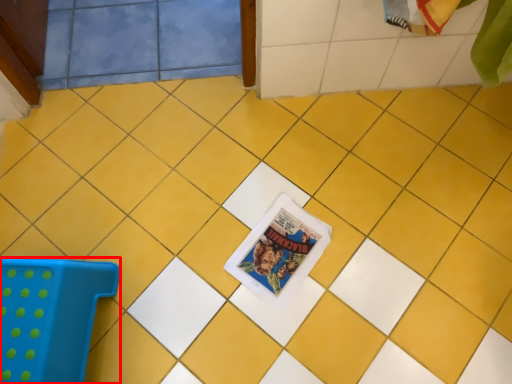
Question: From the image's perspective, where is furniture (annotated by the red box) located in relation to comic book in the image?

Choices:
 (A) below
 (B) above

Answer: (A)